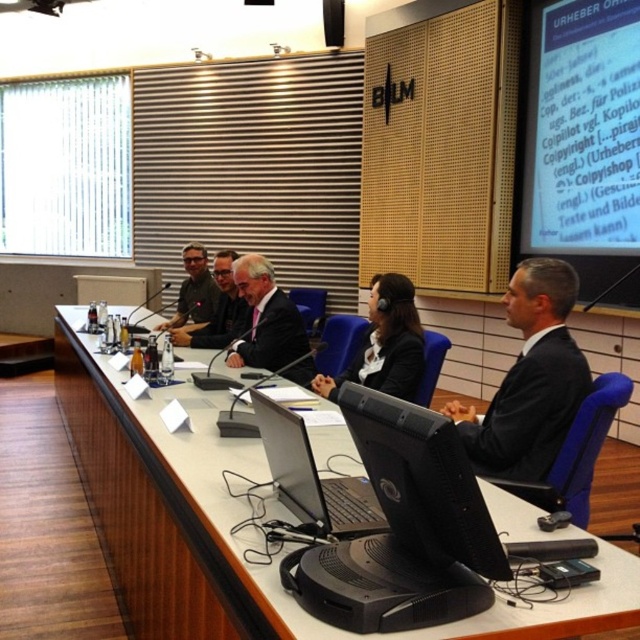
You are a photographer standing behind the table at the center of the room. You want to capture a photo of both the black glossy suit at center and the matte black suit at center in the same frame. Given that your camera has a minimum focus distance of 60 centimeters, will you be able to take the photo without moving closer?

The black glossy suit at center is 59.45 centimeters away from the matte black suit at center. Since the distance between them is less than the camera minimum focus distance of 60 centimeters, the photographer will need to move closer to ensure both suits are in focus.

You are attending a formal meeting and need to access your laptop quickly. The dark suit at center and the silver metallic laptop at center are both on the table. Which object is closer to you if you are sitting at the head of the table?

The dark suit at center is closer to you because it is in front of the silver metallic laptop at center, meaning the laptop is further back along the table.